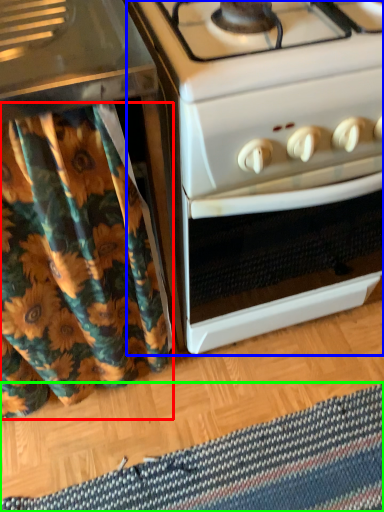
Question: Which is nearer to the shower curtain (highlighted by a red box)? oven (highlighted by a blue box) or mat (highlighted by a green box).

Choices:
 (A) oven
 (B) mat

Answer: (A)